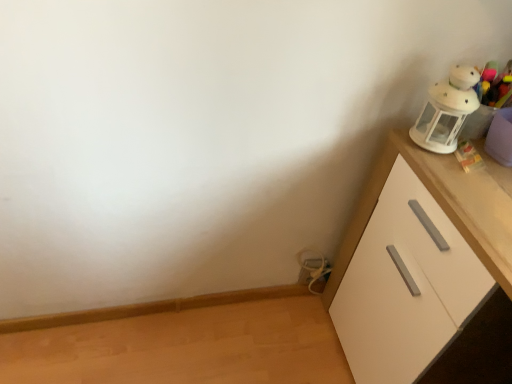
Question: Is point (454, 84) positioned closer to the camera than point (394, 246)?

Choices:
 (A) farther
 (B) closer

Answer: (B)

Question: Considering the positions of white plush toy at upper right, which is the second toy in bottom-to-top order, and white matte cabinet at right in the image, is white plush toy at upper right, which is the second toy in bottom-to-top order, bigger or smaller than white matte cabinet at right?

Choices:
 (A) big
 (B) small

Answer: (B)

Question: Estimate the real-world distances between objects in this image. Which object is closer to the white matte cabinet at right?

Choices:
 (A) metallic silver cable at lower center, which ranks as the first toy in bottom-to-top order
 (B) white plush toy at upper right, the first toy positioned from the top

Answer: (B)

Question: Which object is the closest to the white plush toy at upper right, which is counted as the second toy, starting from the left?

Choices:
 (A) metallic silver cable at lower center, acting as the 1th toy starting from the left
 (B) white matte cabinet at right

Answer: (B)